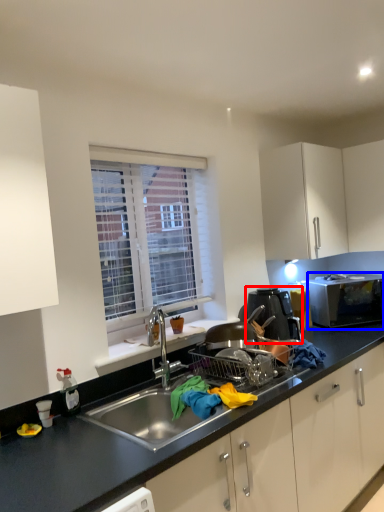
Question: Which of the following is the closest to the observer, home appliance (highlighted by a red box) or microwave oven (highlighted by a blue box)?

Choices:
 (A) home appliance
 (B) microwave oven

Answer: (A)